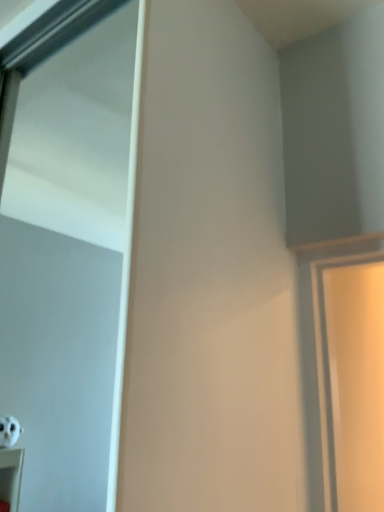
In order to face transparent glass door at upper center, should I rotate leftwards or rightwards?

You should rotate left by 22.506 degrees.

This screenshot has width=384, height=512. Describe the element at coordinates (69, 261) in the screenshot. I see `transparent glass door at upper center` at that location.

Find the location of a particular element. transparent glass door at upper center is located at coordinates [x=69, y=261].

In order to click on transparent glass door at upper center in this screenshot , I will do `click(69, 261)`.